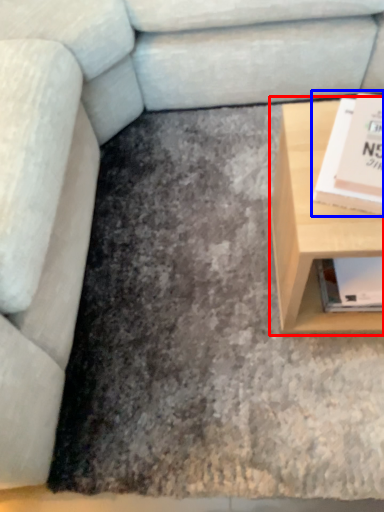
Question: Which object is further to the camera taking this photo, table (highlighted by a red box) or paperback book (highlighted by a blue box)?

Choices:
 (A) table
 (B) paperback book

Answer: (A)